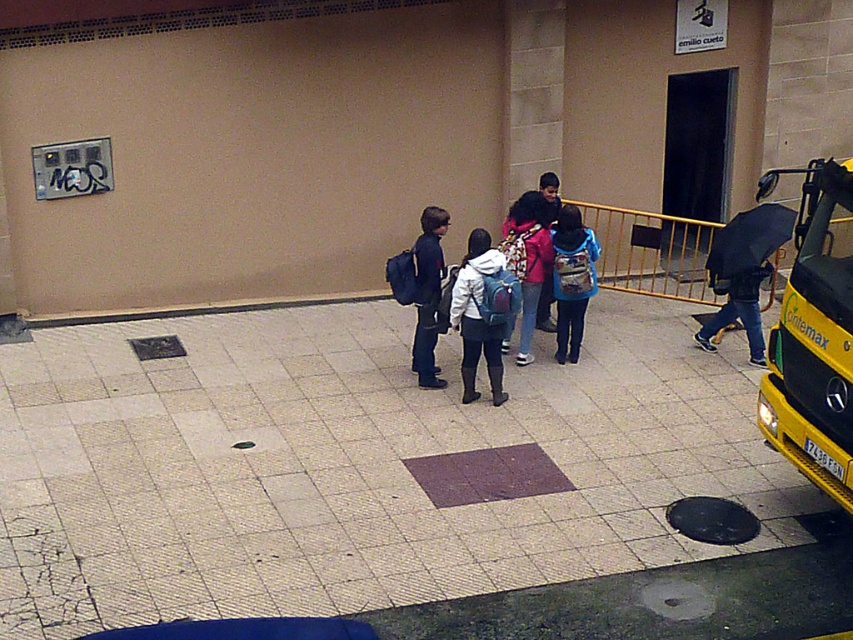
You are standing at the entrance of the building and want to board the yellow metallic bus at right. If the bus is 6.89 meters away from you, how many steps would you need to take to reach it?

The yellow metallic bus at right is 6.89 meters away. Assuming an average step length of about 0.76 meters, you would need approximately 9 steps to reach the bus.

You are a photographer standing at the entrance of the building. You want to take a photo that includes both the blue backpack at center and the matte pink jacket at center. Which object will appear larger in the photo?

The blue backpack at center will appear larger in the photo because it is closer to the viewer than the matte pink jacket at center.